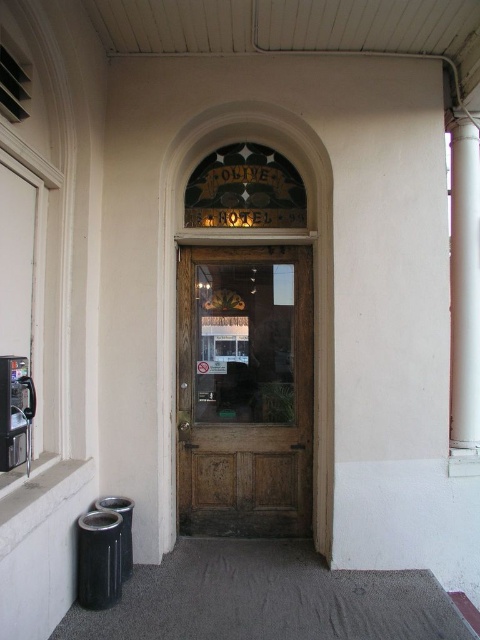
Question: Is wooden door at center bigger than white smooth pillar at right?

Choices:
 (A) yes
 (B) no

Answer: (A)

Question: Can you confirm if wooden door at center is bigger than white smooth pillar at right?

Choices:
 (A) no
 (B) yes

Answer: (B)

Question: Which point is closer to the camera?

Choices:
 (A) (243, 401)
 (B) (477, 321)

Answer: (B)

Question: Does wooden door at center appear over white smooth pillar at right?

Choices:
 (A) yes
 (B) no

Answer: (B)

Question: Which point is closer to the camera?

Choices:
 (A) (475, 349)
 (B) (247, 465)

Answer: (A)

Question: Which point is closer to the camera taking this photo?

Choices:
 (A) (470, 218)
 (B) (274, 506)

Answer: (A)